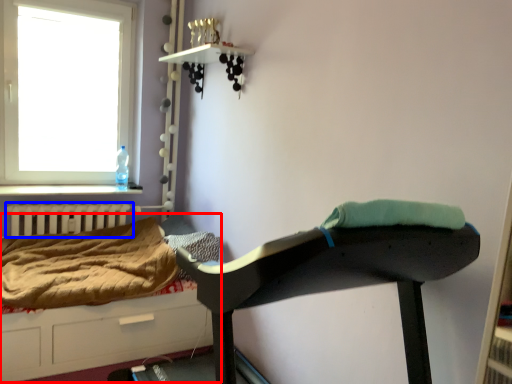
Question: Which of the following is the closest to the observer, hospital bed (highlighted by a red box) or radiator (highlighted by a blue box)?

Choices:
 (A) hospital bed
 (B) radiator

Answer: (A)